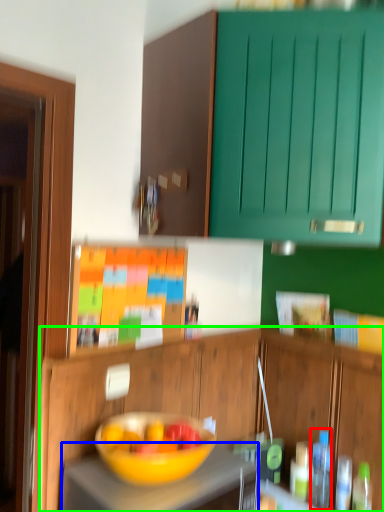
Question: Considering the real-world distances, which object is closest to bottle (highlighted by a red box)? desk (highlighted by a blue box) or cabinetry (highlighted by a green box).

Choices:
 (A) desk
 (B) cabinetry

Answer: (B)